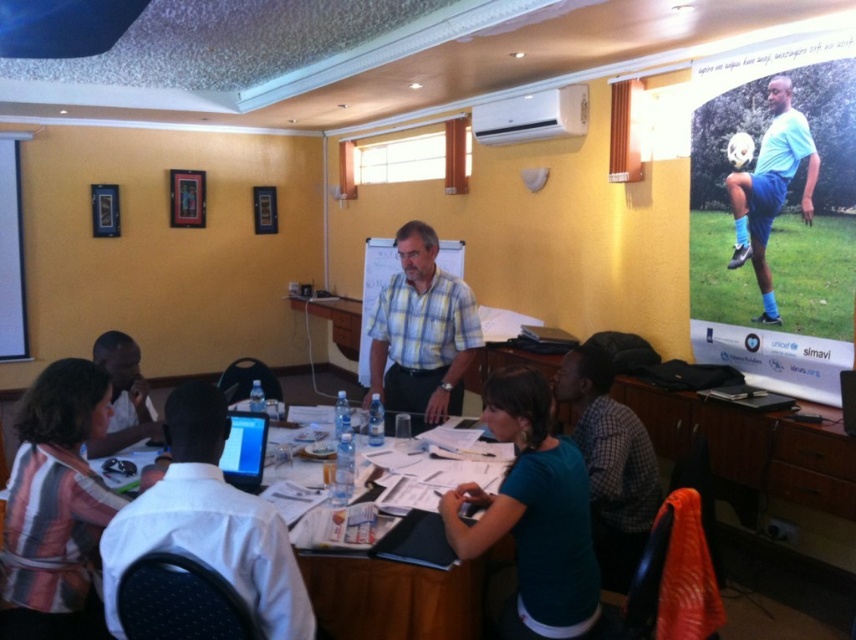
Who is more forward, (107, 529) or (569, 449)?

Point (107, 529) is in front.

Is the position of wooden table at center less distant than that of teal fabric shirt at center?

Yes, it is.

The image size is (856, 640). I want to click on wooden table at center, so click(x=280, y=563).

Between point (10, 518) and point (140, 376), which one is positioned in front?

Positioned in front is point (10, 518).

Between striped fabric shirt at lower left and matte black laptop at left, which one has more height?

With more height is striped fabric shirt at lower left.

Where is `striped fabric shirt at lower left`? The image size is (856, 640). striped fabric shirt at lower left is located at coordinates (57, 506).

In order to click on striped fabric shirt at lower left in this screenshot , I will do `click(57, 506)`.

Which of these two, plaid fabric shirt at center or teal fabric shirt at lower center, stands shorter?

teal fabric shirt at lower center is shorter.

Between plaid fabric shirt at center and teal fabric shirt at lower center, which one is positioned lower?

teal fabric shirt at lower center is lower down.

Between point (459, 285) and point (574, 385), which one is positioned in front?

Positioned in front is point (574, 385).

I want to click on plaid fabric shirt at center, so click(421, 333).